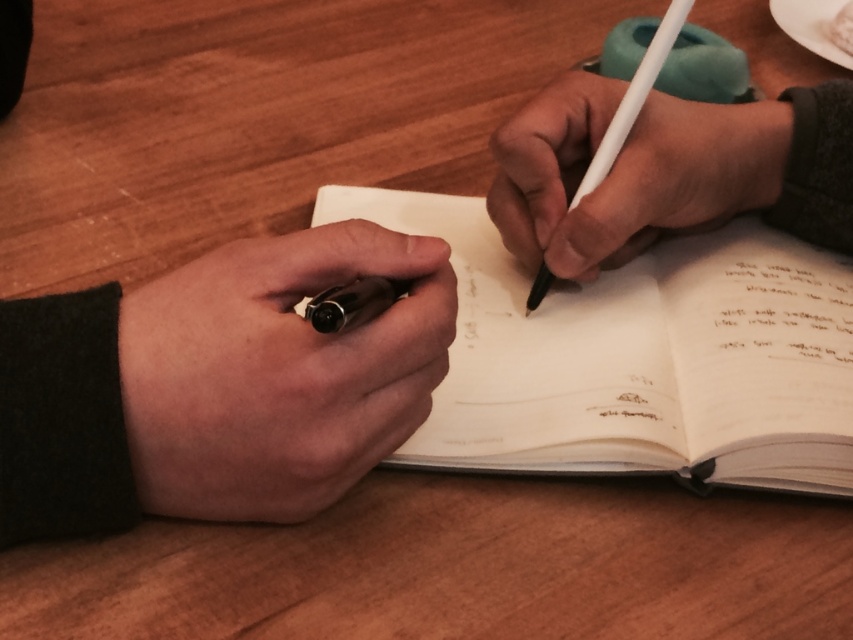
You are a student who needs to borrow a pen. You see a matte black pen at left and a white matte pencil at center. Which one is closer to you?

The distance between the matte black pen at left and the white matte pencil at center is 5.22 inches, so the white matte pencil at center is closer to you than the matte black pen at left.

You are a robot trying to place a new sheet of paper onto the white paper notebook at center. The robot can only place the paper within a 10cm radius of the notebook. Given that the notebook is at point 0.558, 0.748, will the robot be able to place the paper within the required area?

The white paper notebook at center is located at point (637, 356). Since the robot can place the paper within a 10cm radius of the notebook, it will be able to place the paper within the required area as long as the coordinates are within that range. However, without specific coordinate limits, we can assume the placement is feasible based on the given radius.

Based on the scene described, which object is positioned lower between the matte black pen at left and the white matte pencil at center?

The matte black pen at left is positioned below the white matte pencil at center, so it is lower.